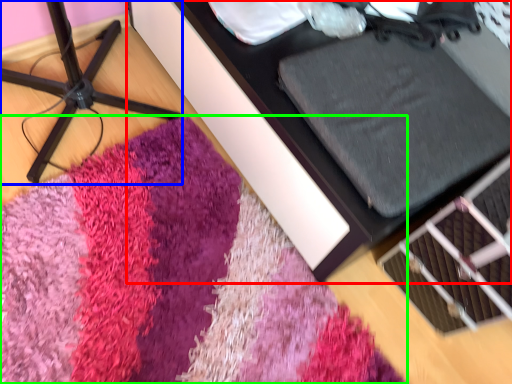
Question: Based on their relative distances, which object is farther from furniture (highlighted by a red box)? Choose from furniture (highlighted by a blue box) and mat (highlighted by a green box).

Choices:
 (A) furniture
 (B) mat

Answer: (A)